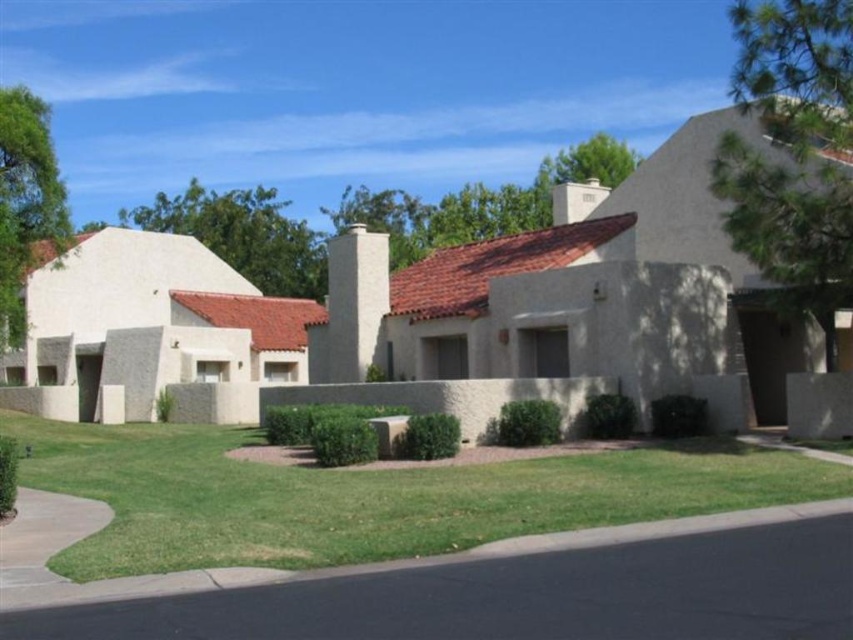
Question: Which point is closer to the camera taking this photo?

Choices:
 (A) (303, 248)
 (B) (712, 483)
 (C) (775, 202)

Answer: (B)

Question: Which point appears closest to the camera in this image?

Choices:
 (A) (276, 232)
 (B) (74, 460)

Answer: (B)

Question: In this image, where is green grass at lower center located relative to green textured pine tree at upper right?

Choices:
 (A) right
 (B) left

Answer: (B)

Question: Is green grass at lower center behind green leafy tree at upper center?

Choices:
 (A) no
 (B) yes

Answer: (A)

Question: Is green leafy tree at upper center positioned at the back of green leafy tree at upper left?

Choices:
 (A) yes
 (B) no

Answer: (A)

Question: Which of the following is the closest to the observer?

Choices:
 (A) click(784, 3)
 (B) click(194, 225)

Answer: (A)